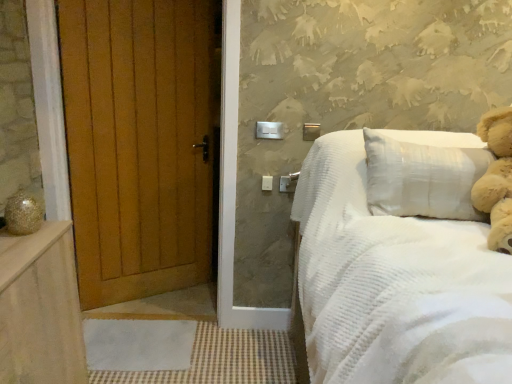
Question: Is fluffy beige teddy bear at upper right in front of or behind white corduroy bed at right in the image?

Choices:
 (A) behind
 (B) front

Answer: (A)

Question: From the image's perspective, is fluffy beige teddy bear at upper right located above or below white corduroy bed at right?

Choices:
 (A) below
 (B) above

Answer: (B)

Question: Which is nearer to the white corduroy bed at right?

Choices:
 (A) wooden door at left
 (B) fluffy beige teddy bear at upper right
 (C) wooden balustrade at lower left

Answer: (B)

Question: Estimate the real-world distances between objects in this image. Which object is closer to the white corduroy bed at right?

Choices:
 (A) fluffy beige teddy bear at upper right
 (B) wooden door at left
 (C) wooden balustrade at lower left

Answer: (A)